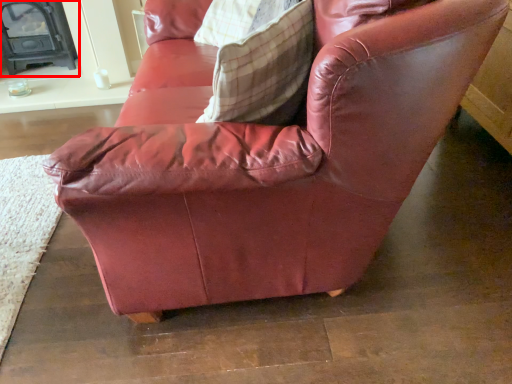
Question: From the image's perspective, where is fireplace (annotated by the red box) located relative to throw pillow?

Choices:
 (A) above
 (B) below

Answer: (A)